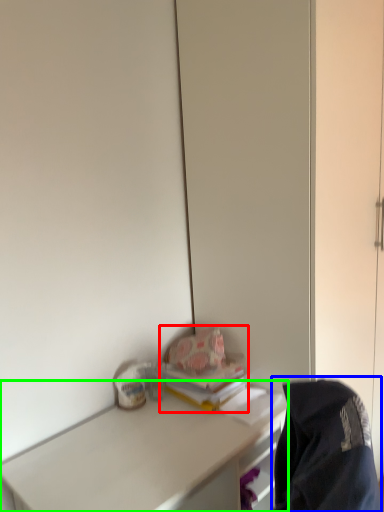
Question: Based on their relative distances, which object is nearer to book (highlighted by a red box)? Choose from jacket (highlighted by a blue box) and desk (highlighted by a green box).

Choices:
 (A) jacket
 (B) desk

Answer: (B)